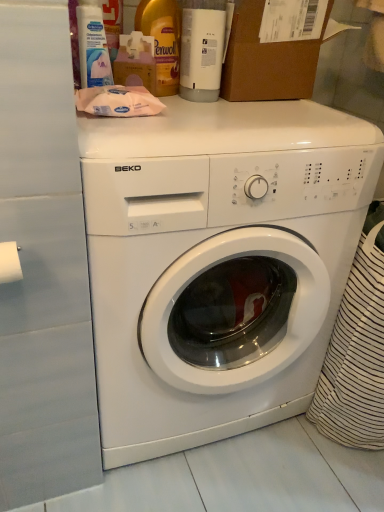
This screenshot has height=512, width=384. I want to click on empty space that is to the right of white plastic bottle at upper left, so coord(193,108).